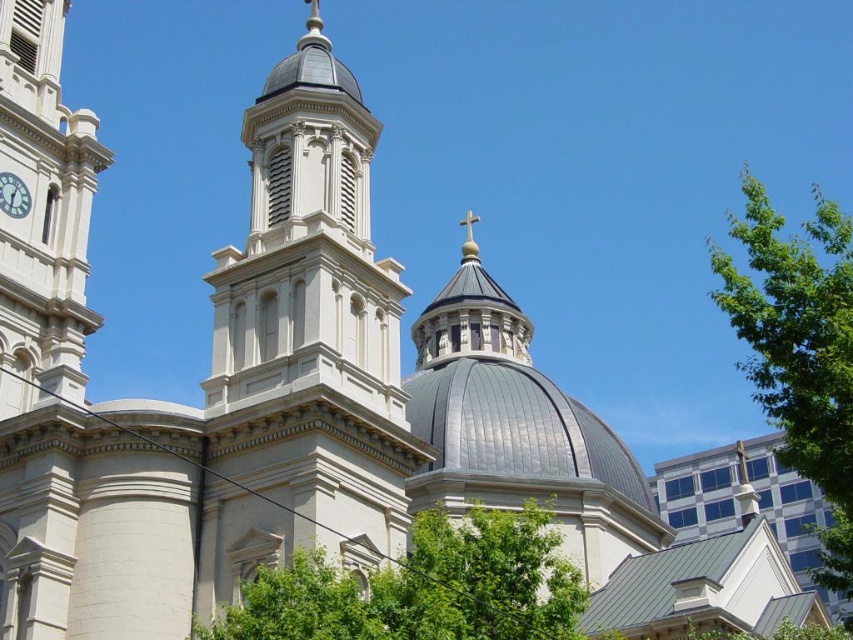
In the scene shown: You are an architect analyzing the layout of this building. Based on the image, which tower is positioned lower in the structure, the smooth white tower at center or the white stone clock tower at left?

The smooth white tower at center is positioned below the white stone clock tower at left, so the smooth white tower at center is lower in the structure.

You are standing in front of the grand architectural structure described. You notice a point marked at coordinates [44,202]. Based on the scene, what does this point indicate?

The point at coordinates [44,202] marks the location of the white stone clock tower at left.